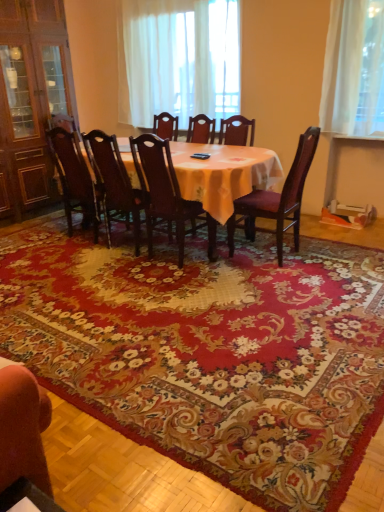
This screenshot has width=384, height=512. In order to click on vacant area that is in front of wooden chair at center, the third chair viewed from the right in this screenshot , I will do `click(184, 284)`.